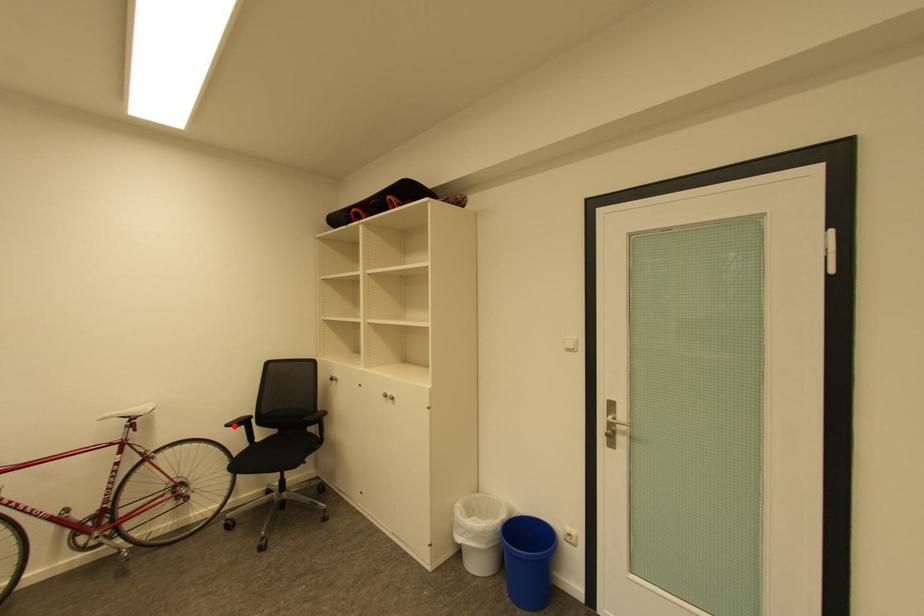
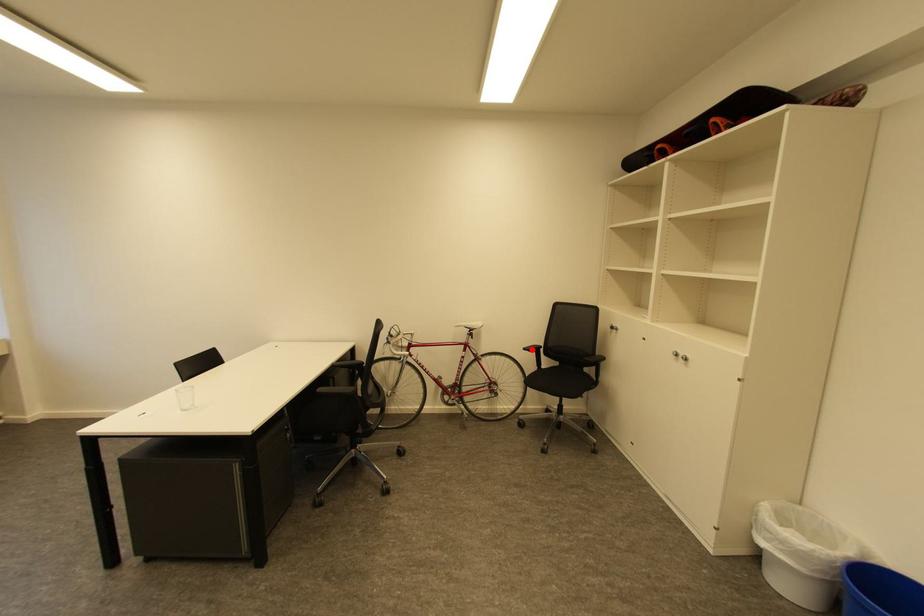
I am providing you with two images of the same scene from different viewpoints. A red point is marked on the first image and another point is marked on the second image. Are the points marked in image1 and image2 representing the same 3D position?

Yes